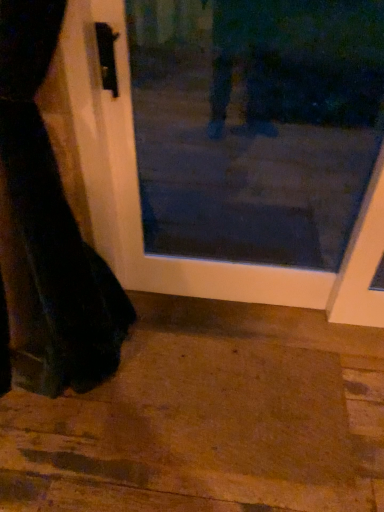
This screenshot has height=512, width=384. What do you see at coordinates (54, 212) in the screenshot?
I see `black denim jeans at lower left` at bounding box center [54, 212].

The height and width of the screenshot is (512, 384). I want to click on black denim jeans at lower left, so click(x=54, y=212).

In order to face black denim jeans at lower left, should I rotate leftwards or rightwards?

It's best to rotate left around 21.849 degrees.

The height and width of the screenshot is (512, 384). Find the location of `black denim jeans at lower left`. black denim jeans at lower left is located at coordinates (54, 212).